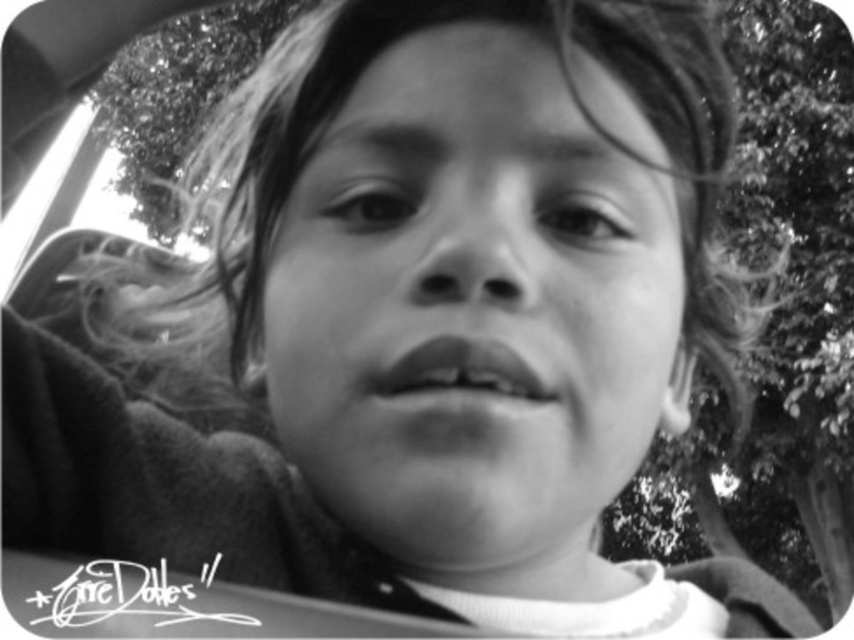
The height and width of the screenshot is (640, 854). Describe the element at coordinates (472, 307) in the screenshot. I see `smooth skin face at center` at that location.

Is point (531, 188) farther from camera compared to point (411, 387)?

That is True.

This screenshot has width=854, height=640. In order to click on smooth skin face at center in this screenshot , I will do `click(472, 307)`.